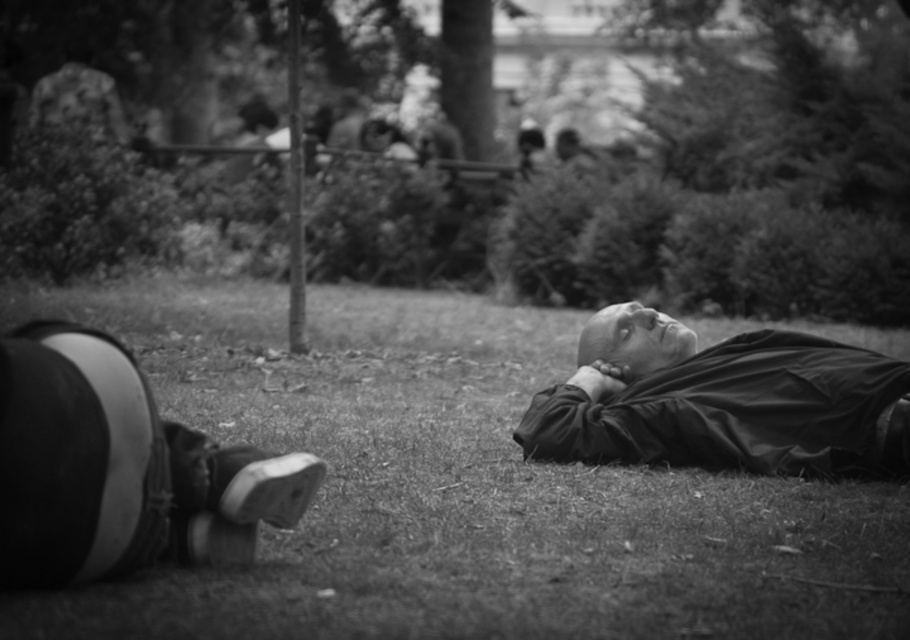
Question: Which point appears farthest from the camera in this image?

Choices:
 (A) (726, 438)
 (B) (408, 332)

Answer: (B)

Question: Which of the following is the closest to the observer?

Choices:
 (A) smooth black jacket at center
 (B) grassy lawn at center

Answer: (B)

Question: Observing the image, what is the correct spatial positioning of grassy lawn at center in reference to smooth black jacket at center?

Choices:
 (A) left
 (B) right

Answer: (A)

Question: Which point is closer to the camera?

Choices:
 (A) (693, 422)
 (B) (229, 378)

Answer: (A)

Question: Does grassy lawn at center appear on the left side of smooth black jacket at center?

Choices:
 (A) yes
 (B) no

Answer: (A)

Question: Does grassy lawn at center have a smaller size compared to smooth black jacket at center?

Choices:
 (A) yes
 (B) no

Answer: (B)